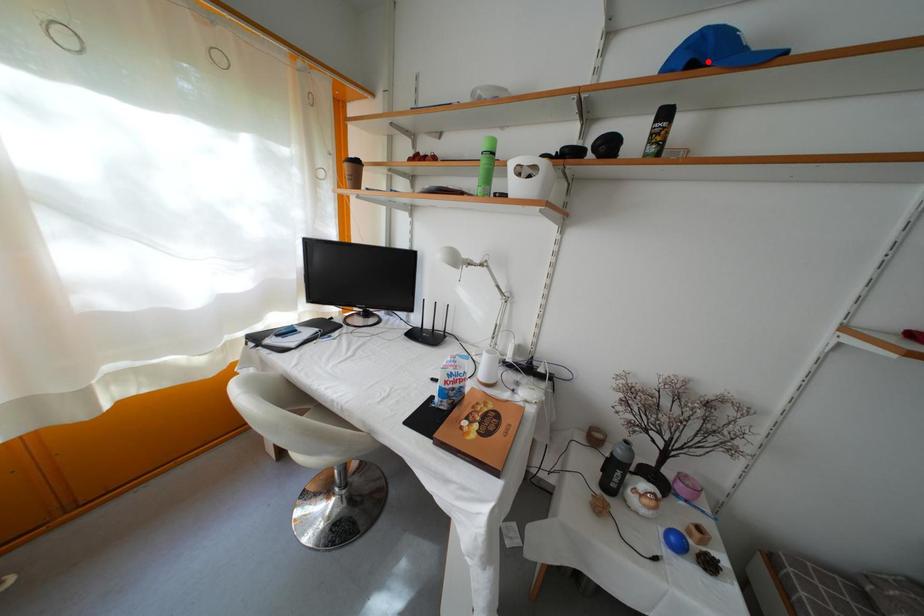
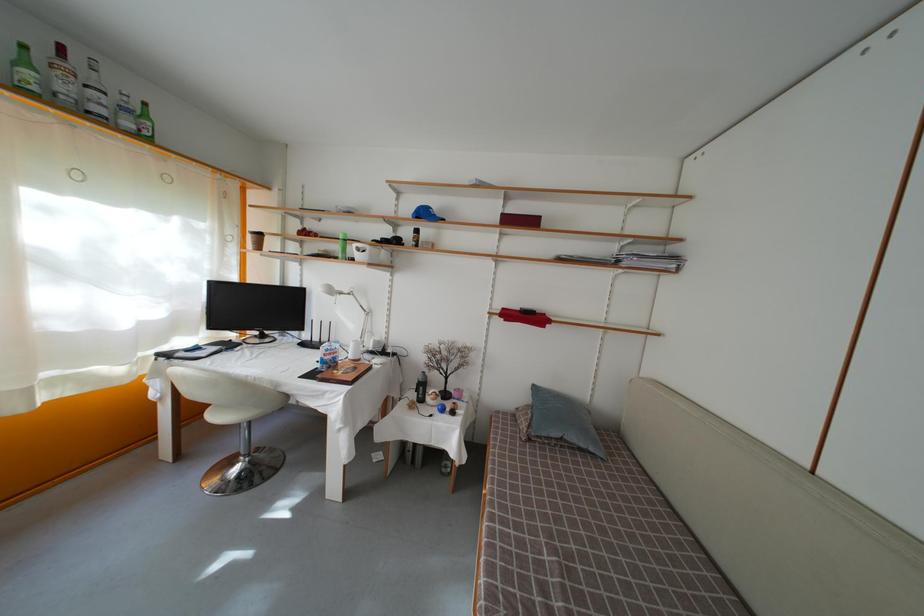
The point at the highlighted location is marked in the first image. Where is the corresponding point in the second image?

(430, 220)